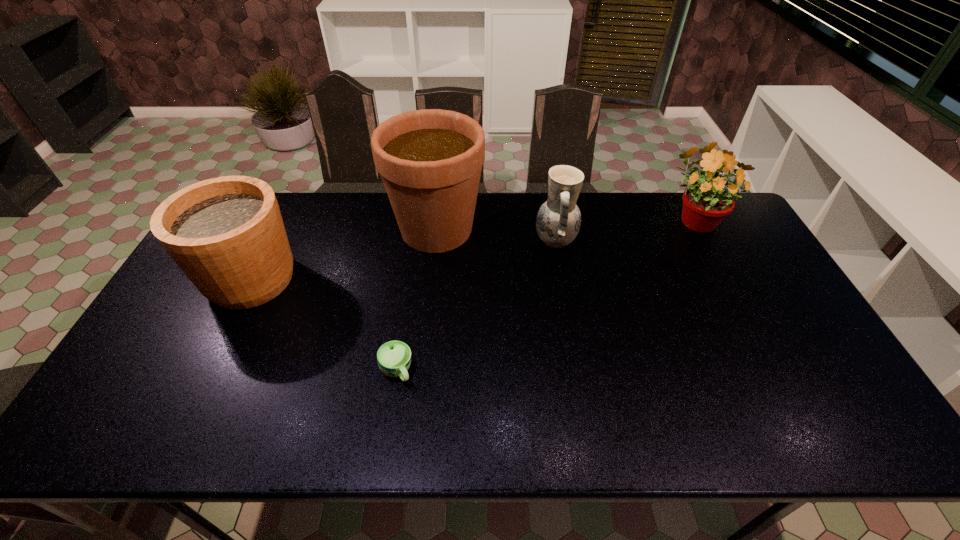
The image size is (960, 540). What are the coordinates of `free space located on either side of the second object from right to left` in the screenshot? It's located at (421, 241).

Where is `vacant region located 0.050m on either side of the second object from right to left`? The width and height of the screenshot is (960, 540). vacant region located 0.050m on either side of the second object from right to left is located at coordinates (518, 241).

Where is `vacant area located on the back of the shortest object`? vacant area located on the back of the shortest object is located at coordinates (410, 284).

Where is `pottery situated at the far edge`? Image resolution: width=960 pixels, height=540 pixels. pottery situated at the far edge is located at coordinates (558, 221).

I want to click on object positioned at the left edge, so click(x=226, y=234).

This screenshot has width=960, height=540. Identify the location of object that is at the right edge. (705, 205).

Locate an element on the screen. The image size is (960, 540). object positioned at the far right corner is located at coordinates (705, 205).

Identify the location of free region at the near edge of the desktop. (236, 421).

At what (x,y) coordinates should I click in order to perform the action: click on vacant space at the left edge. Please return your answer as a coordinate pair (x, y). Looking at the image, I should click on (181, 342).

Find the location of a particular element. The image size is (960, 540). vacant space at the right edge is located at coordinates (751, 289).